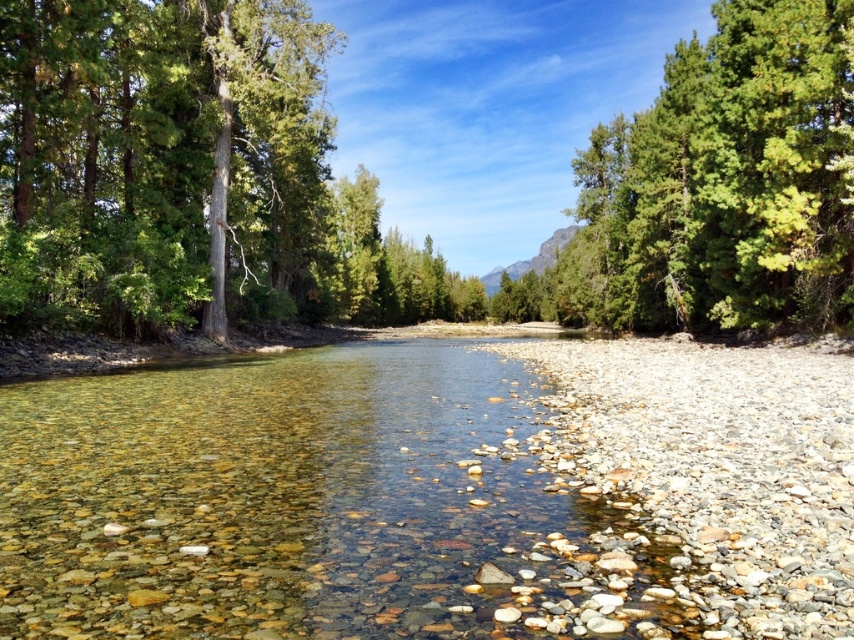
You are standing at the riverbank and want to cross the river to the other side. The green leafy forest at center and the clear pebbled water at center are in your path. Which one is above the other and would you need to navigate around?

The green leafy forest at center is positioned over clear pebbled water at center, so you would need to navigate around the forest which is above the water.